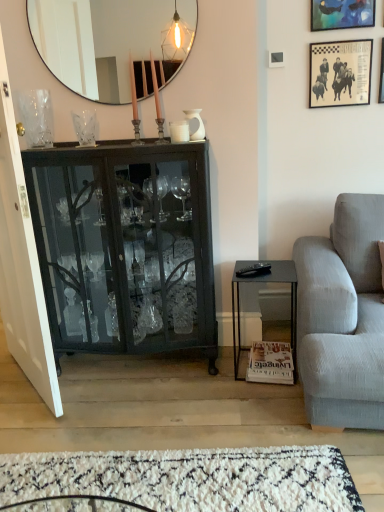
Where is `free space in front of black glass cabinet at left`? The width and height of the screenshot is (384, 512). free space in front of black glass cabinet at left is located at coordinates (132, 414).